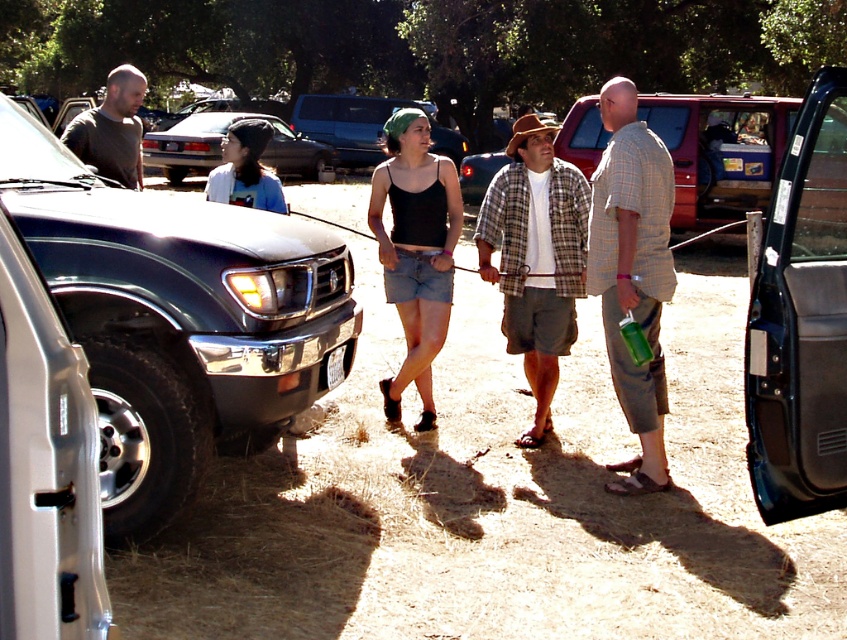
Question: Is shiny black truck at left smaller than matte black suv at center?

Choices:
 (A) yes
 (B) no

Answer: (B)

Question: Estimate the real-world distances between objects in this image. Which object is farther from the knit beanie at center?

Choices:
 (A) plaid cotton shirt at center
 (B) metallic red van at center
 (C) black denim shorts at center

Answer: (B)

Question: Can you confirm if shiny black truck at left is positioned below matte black suv at center?

Choices:
 (A) yes
 (B) no

Answer: (A)

Question: Is plaid cotton shirt at center smaller than metallic red van at center?

Choices:
 (A) yes
 (B) no

Answer: (A)

Question: Which point is closer to the camera?

Choices:
 (A) (598, 147)
 (B) (386, 410)

Answer: (B)

Question: Which is nearer to the knit beanie at center?

Choices:
 (A) metallic blue door at right
 (B) matte black suv at center
 (C) matte gray suv at center

Answer: (C)